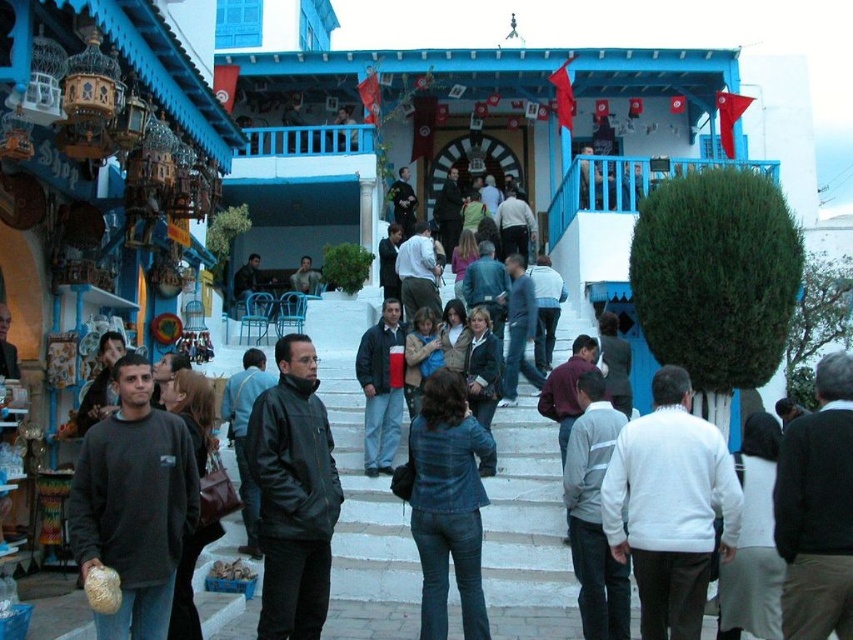
How much distance is there between black leather jacket at center and dark gray jacket at center?

14.65 meters

Does black leather jacket at center lie in front of dark gray jacket at center?

That is True.

I want to click on black leather jacket at center, so click(293, 493).

Between point (164, 604) and point (263, 452), which one is positioned in front?

Positioned in front is point (164, 604).

Which is behind, point (97, 472) or point (323, 580)?

The point (323, 580) is behind.

The image size is (853, 640). I want to click on dark gray sweater at center, so click(x=134, y=502).

Is denim jacket at center wider than dark gray jacket at center?

Yes, denim jacket at center is wider than dark gray jacket at center.

Does denim jacket at center have a larger size compared to dark gray jacket at center?

Correct, denim jacket at center is larger in size than dark gray jacket at center.

Consider the image. Measure the distance between denim jacket at center and camera.

denim jacket at center and camera are 41.23 meters apart from each other.

Where is `denim jacket at center`? The width and height of the screenshot is (853, 640). denim jacket at center is located at coordinates (445, 502).